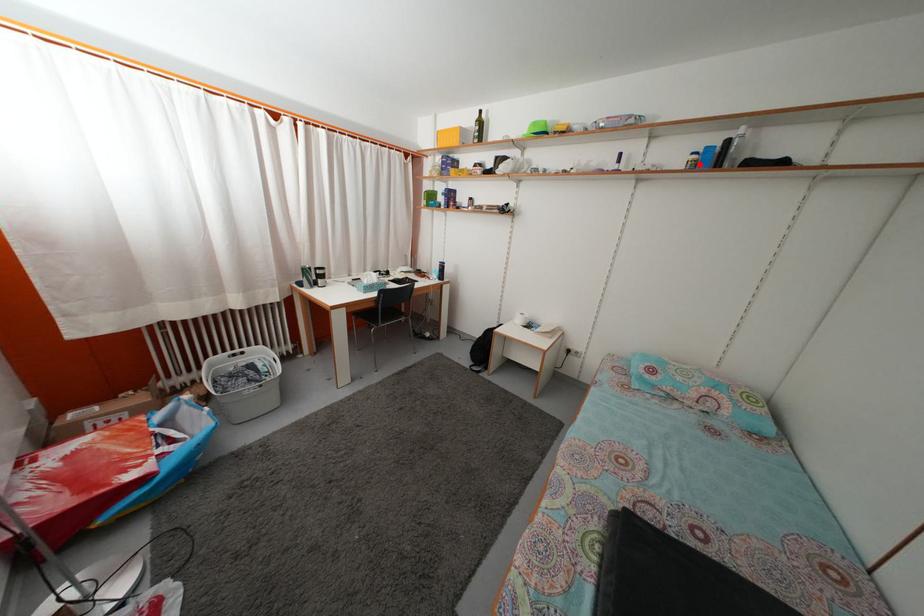
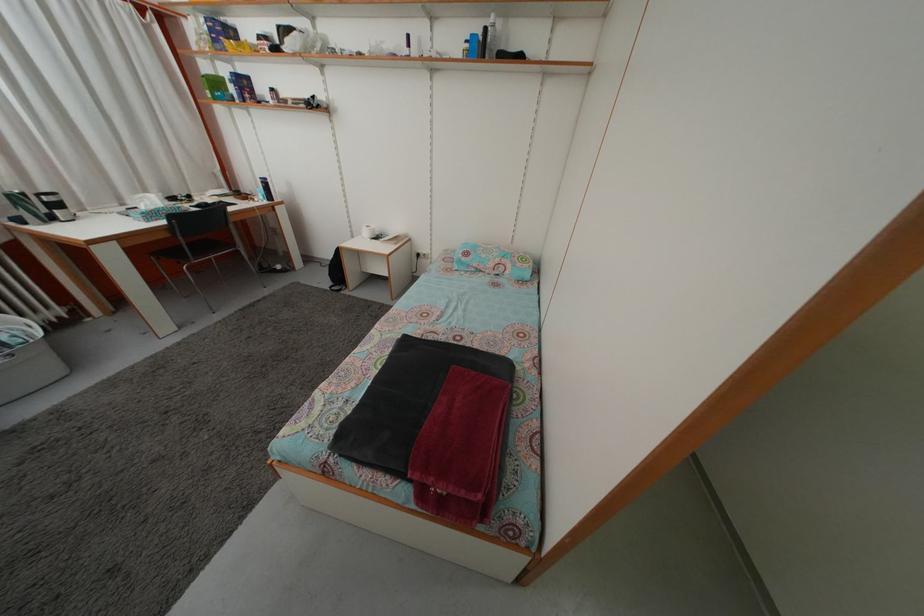
The point at the highlighted location is marked in the first image. Where is the corresponding point in the second image?

(473, 53)